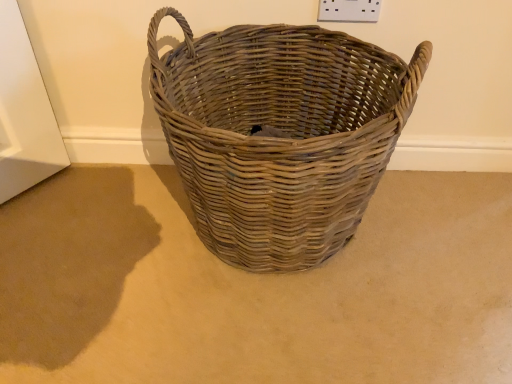
Find the location of `vacant space in front of natural woven basket at center`. vacant space in front of natural woven basket at center is located at coordinates (272, 342).